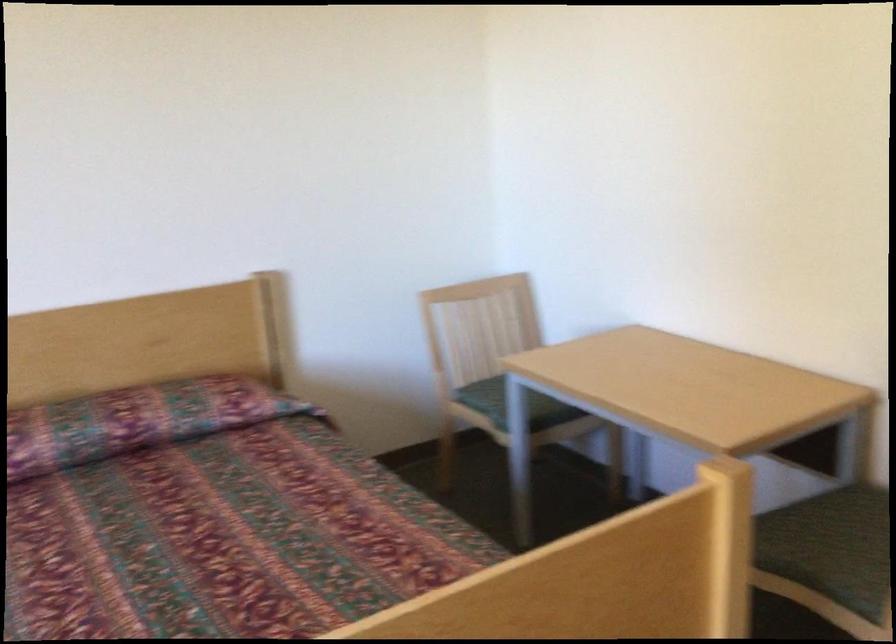
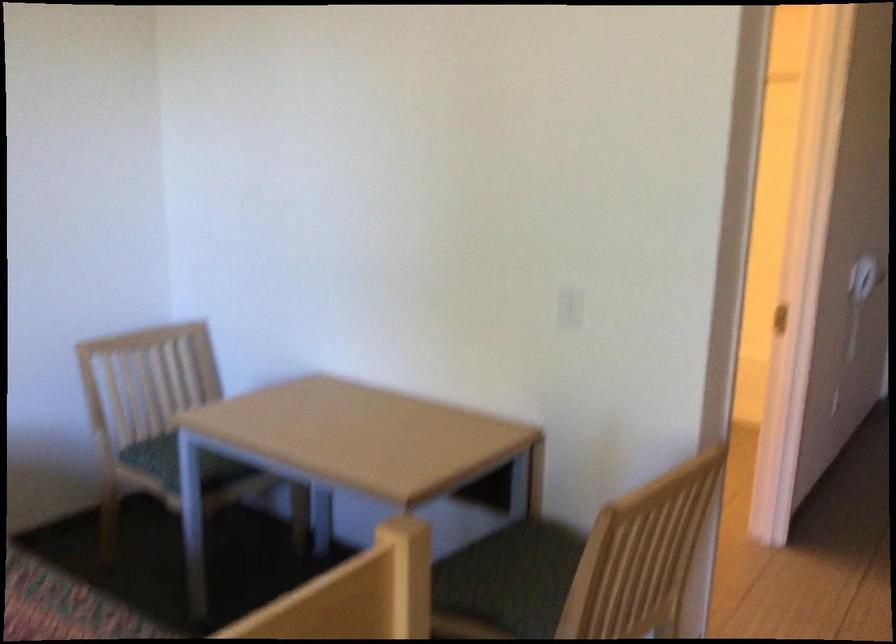
In a continuous first-person perspective shot, in which direction is the camera moving?

The cameraman moved toward right, forward.